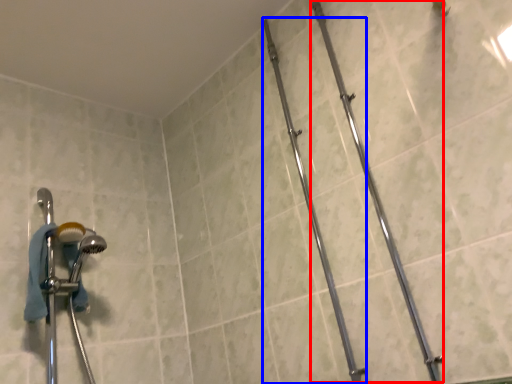
Question: Among these objects, which one is nearest to the camera, pipe (highlighted by a red box) or pipe (highlighted by a blue box)?

Choices:
 (A) pipe
 (B) pipe

Answer: (A)